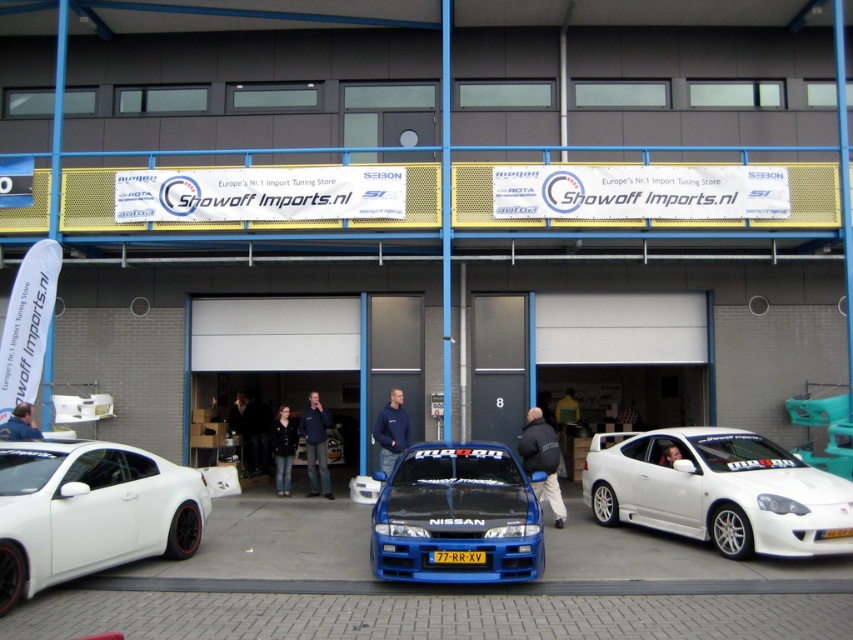
Question: Can you confirm if white matte car at lower left is positioned to the left of shiny blue car at center?

Choices:
 (A) no
 (B) yes

Answer: (B)

Question: Is the position of white matte car at lower left less distant than that of shiny blue car at center?

Choices:
 (A) yes
 (B) no

Answer: (A)

Question: Is the position of white glossy car at center less distant than that of yellow matte license plate at center?

Choices:
 (A) yes
 (B) no

Answer: (B)

Question: Which point appears farthest from the camera in this image?

Choices:
 (A) (392, 484)
 (B) (776, 522)

Answer: (A)

Question: Which object appears farthest from the camera in this image?

Choices:
 (A) white matte car at lower left
 (B) yellow matte license plate at center

Answer: (B)

Question: Which is nearer to the yellow matte license plate at center?

Choices:
 (A) white glossy car at center
 (B) white matte car at lower left
 (C) shiny blue car at center

Answer: (C)